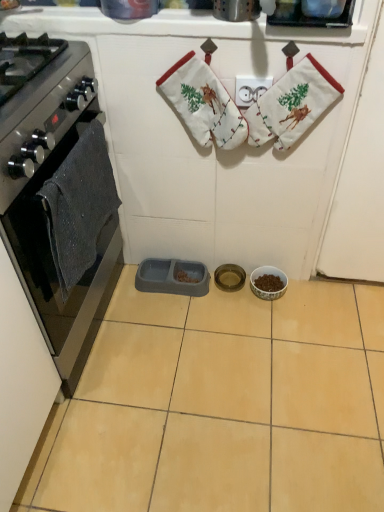
This screenshot has width=384, height=512. Identify the location of free spot in front of metallic gold bowl at center, which ranks as the second appliance in left-to-right order. (233, 316).